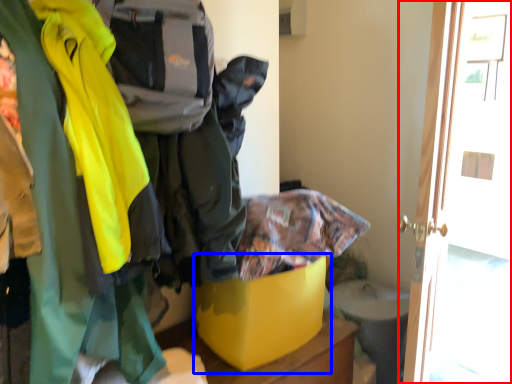
Question: Which of the following is the closest to the observer, door (highlighted by a red box) or storage box (highlighted by a blue box)?

Choices:
 (A) door
 (B) storage box

Answer: (B)